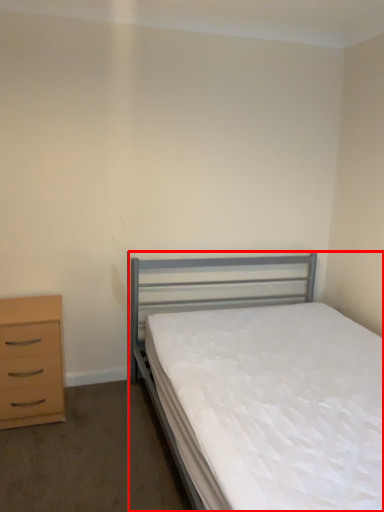
Question: Observing the image, what is the correct spatial positioning of bed (annotated by the red box) in reference to chest of drawers?

Choices:
 (A) right
 (B) left

Answer: (A)